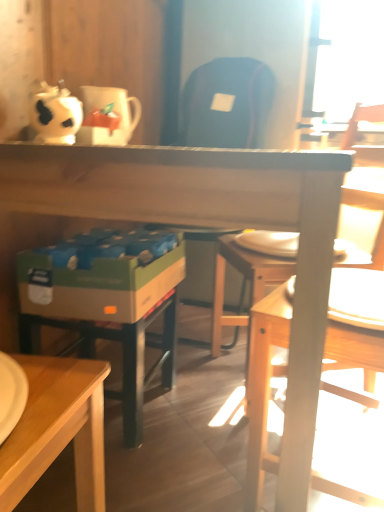
In the scene shown: In order to face wooden desk at center, should I rotate leftwards or rightwards?

Turn left by 1.161 degrees to look at wooden desk at center.

This screenshot has width=384, height=512. I want to click on wooden desk at center, so click(x=204, y=217).

Which of these two, wooden chair at right or wooden desk at center, is wider?

wooden desk at center.

Is wooden chair at right not inside wooden desk at center?

No, wooden chair at right is not entirely external to wooden desk at center.

Considering the positions of points (348, 492) and (276, 160), is point (348, 492) farther from camera compared to point (276, 160)?

That is True.

From a real-world perspective, which object stands above the other?

wooden chair at right, from a real-world perspective.

Would you say wooden desk at center is a long distance from wooden chair at right?

Actually, wooden desk at center and wooden chair at right are a little close together.

Is wooden chair at right located within wooden desk at center?

Absolutely, wooden chair at right is inside wooden desk at center.

Is wooden chair at right completely or partially inside white glossy coffee cup at upper left?

No, wooden chair at right is not inside white glossy coffee cup at upper left.

Is white glossy coffee cup at upper left touching wooden chair at right?

There is a gap between white glossy coffee cup at upper left and wooden chair at right.

Find the location of a particular element. Image resolution: width=384 pixels, height=512 pixels. coffee cup on the left of the wooden chair at right is located at coordinates (113, 111).

From the image's perspective, is white glossy coffee cup at upper left above or below wooden chair at right?

Based on their image positions, white glossy coffee cup at upper left is located above wooden chair at right.

Consider the image. Is wooden chair at right aimed at white glossy coffee cup at upper left?

Yes, wooden chair at right is aimed at white glossy coffee cup at upper left.

Does wooden chair at right have a greater height compared to white glossy coffee cup at upper left?

Yes, wooden chair at right is taller than white glossy coffee cup at upper left.

How many degrees apart are the facing directions of wooden chair at right and white glossy coffee cup at upper left?

The facing directions of wooden chair at right and white glossy coffee cup at upper left are 165 degrees apart.

Between wooden desk at center and white glossy coffee cup at upper left, which one has smaller size?

white glossy coffee cup at upper left is smaller.

How many degrees apart are the facing directions of wooden desk at center and white glossy coffee cup at upper left?

The angle between the facing direction of wooden desk at center and the facing direction of white glossy coffee cup at upper left is 1.21 degrees.

Who is shorter, wooden desk at center or white glossy coffee cup at upper left?

white glossy coffee cup at upper left is shorter.

Is wooden desk at center surrounded by white glossy coffee cup at upper left?

No, wooden desk at center is not surrounded by white glossy coffee cup at upper left.

Does white glossy coffee cup at upper left appear on the right side of wooden desk at center?

No, white glossy coffee cup at upper left is not to the right of wooden desk at center.

Which of these two, white glossy coffee cup at upper left or wooden desk at center, is thinner?

white glossy coffee cup at upper left is thinner.

In order to click on chair on the right of the wooden desk at center in this screenshot , I will do `click(266, 409)`.

The image size is (384, 512). I want to click on desk lying on the left of wooden chair at right, so click(204, 217).

Which object lies nearer to the anchor point wooden desk at center, white glossy coffee cup at upper left or wooden chair at right?

wooden chair at right is closer to wooden desk at center.

Based on their spatial positions, is wooden chair at right or wooden desk at center further from white glossy coffee cup at upper left?

wooden chair at right is positioned further to the anchor white glossy coffee cup at upper left.

Which object lies nearer to the anchor point white glossy coffee cup at upper left, wooden desk at center or wooden chair at right?

Based on the image, wooden desk at center appears to be nearer to white glossy coffee cup at upper left.

Looking at the image, which one is located closer to wooden desk at center, wooden chair at right or white glossy coffee cup at upper left?

wooden chair at right.

Looking at the image, which one is located closer to wooden chair at right, wooden desk at center or white glossy coffee cup at upper left?

wooden desk at center is positioned closer to the anchor wooden chair at right.

From the picture: Based on their spatial positions, is white glossy coffee cup at upper left or wooden desk at center closer to wooden chair at right?

The object closer to wooden chair at right is wooden desk at center.

This screenshot has height=512, width=384. In order to click on chair between wooden desk at center and white glossy coffee cup at upper left along the z-axis in this screenshot , I will do `click(266, 409)`.